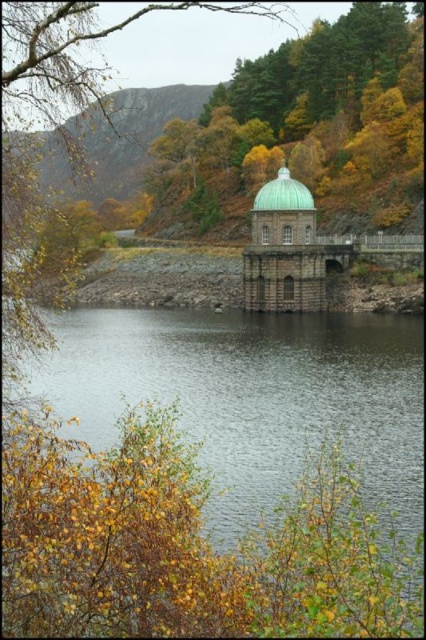
You are standing at the edge of the water and want to reach the transparent water at center. According to the coordinates provided, in which direction should you move to reach it?

The transparent water at center is located at point (216, 477), so you should move towards the center of the image from the edge to reach it.

You are a maintenance worker inspecting the dam structure. You notice the transparent water at center and the green polished dome at center. Which object is located above the other?

The green polished dome at center is above the transparent water at center because the water is positioned under the dome.